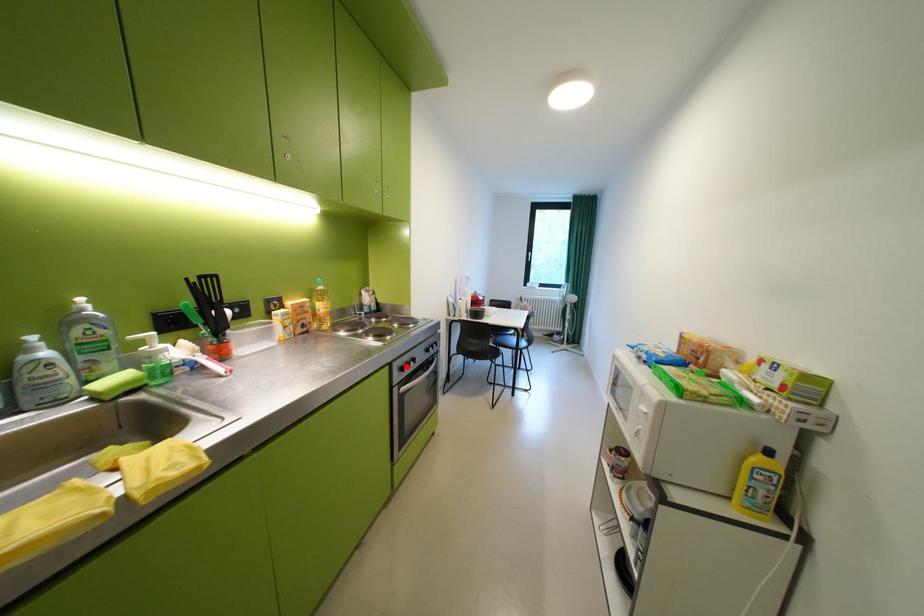
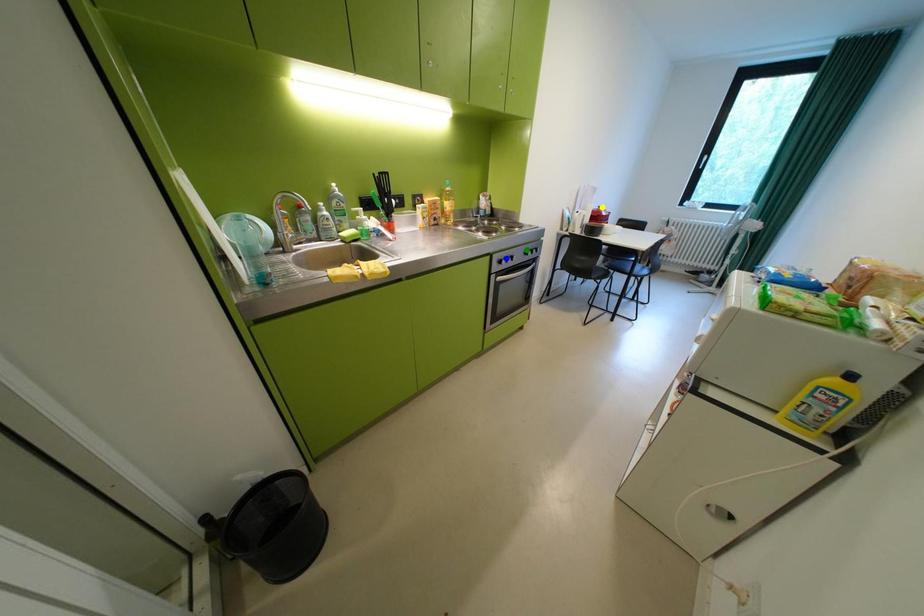
Question: I am providing you with two images of the same scene from different viewpoints. A red point is marked on the first image. You are given multiple points on the second image. In image 2, which mark is for the same physical point as the one in image 1?

Choices:
 (A) yellow point
 (B) green point
 (C) blue point

Answer: (C)